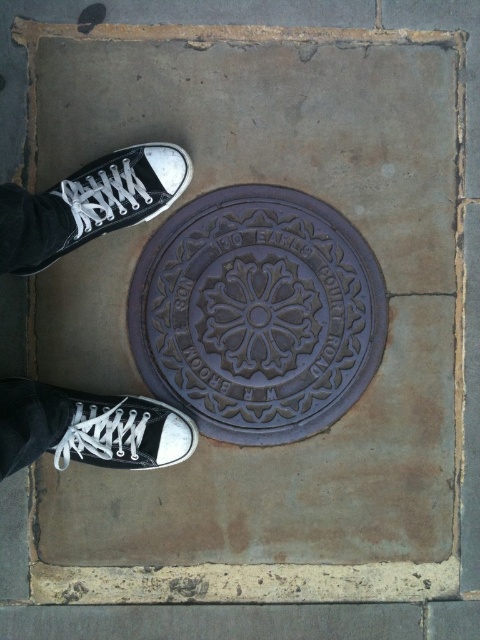
You are taking a photo of the manhole cover and notice two points marked on the image. The first point is at coordinate point (72,410) and the second is at point (137,179). Which point is closer to the camera?

Point (72,410) is closer to the camera than point (137,179).

You are standing on a paved surface and notice a purple cast iron manhole at center. If you were to draw a straight line from your current position to the manhole, what coordinates would mark its center?

The center of the purple cast iron manhole at center is located at coordinates [256,314].